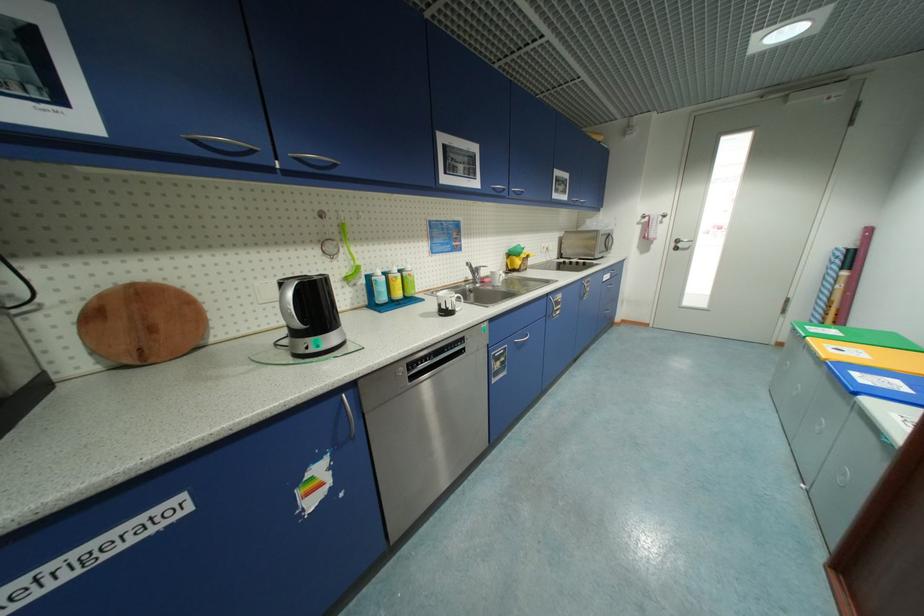
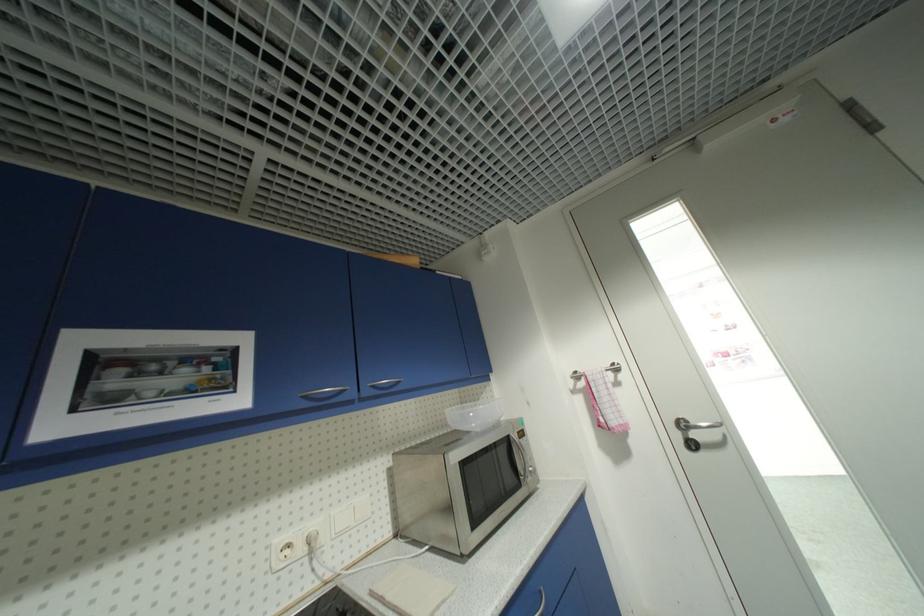
Find the pixel in the second image that matches point 684,241 in the first image.

(688, 426)